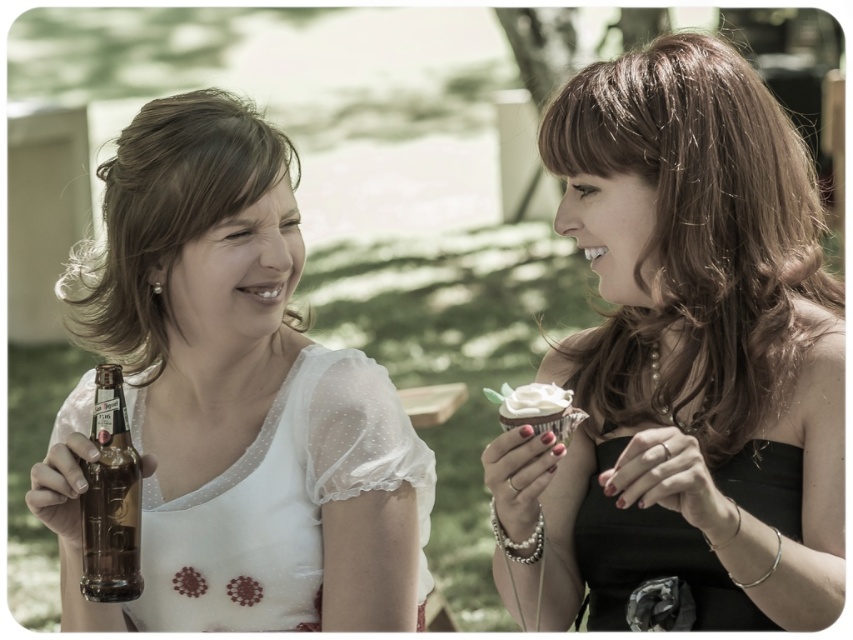
Question: Can you confirm if matte glass beer bottle at left is wider than matte white blouse at left?

Choices:
 (A) no
 (B) yes

Answer: (B)

Question: Which is farther from the matte white blouse at left?

Choices:
 (A) matte black dress at right
 (B) matte glass beer bottle at left

Answer: (A)

Question: Among these objects, which one is nearest to the camera?

Choices:
 (A) matte black dress at right
 (B) matte white blouse at left
 (C) brown glass beer bottle at lower left

Answer: (A)

Question: Is matte black dress at right below brown glass beer bottle at lower left?

Choices:
 (A) no
 (B) yes

Answer: (A)

Question: Among these objects, which one is nearest to the camera?

Choices:
 (A) matte white blouse at left
 (B) matte glass beer bottle at left
 (C) white frosted cupcake at right

Answer: (C)

Question: Is matte black dress at right below white frosted cupcake at right?

Choices:
 (A) no
 (B) yes

Answer: (A)